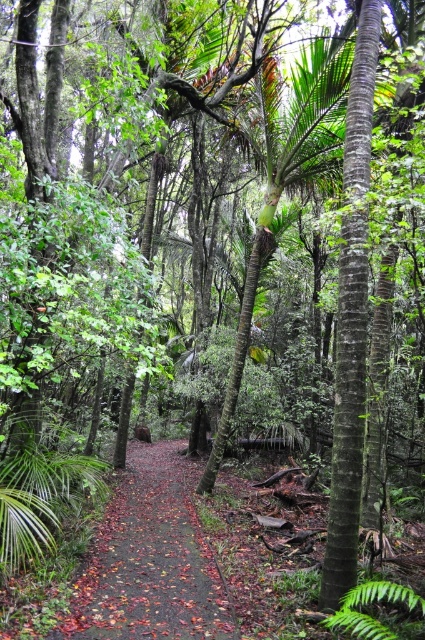
Question: Among these points, which one is farthest from the camera?

Choices:
 (A) (393, 592)
 (B) (116, 589)

Answer: (B)

Question: Can you confirm if brown dirt path at center is positioned to the right of green leafy fern at center?

Choices:
 (A) yes
 (B) no

Answer: (B)

Question: Is brown dirt path at center behind green leafy fern at center?

Choices:
 (A) no
 (B) yes

Answer: (B)

Question: Among these objects, which one is farthest from the camera?

Choices:
 (A) green leafy fern at center
 (B) brown dirt path at center

Answer: (B)

Question: Considering the relative positions of brown dirt path at center and green leafy fern at center in the image provided, where is brown dirt path at center located with respect to green leafy fern at center?

Choices:
 (A) left
 (B) right

Answer: (A)